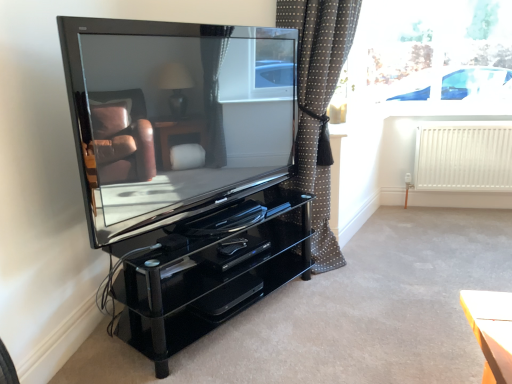
Where is `free space in front of white matte radiator at right`? This screenshot has height=384, width=512. free space in front of white matte radiator at right is located at coordinates (462, 226).